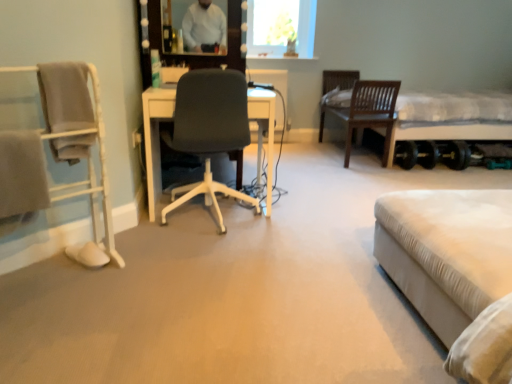
Where is `vacant area that lies between white fabric bed at lower right, which ranks as the 1th bed in bottom-to-top order, and black fabric chair at center, which appears as the 2th chair when viewed from the right`? Image resolution: width=512 pixels, height=384 pixels. vacant area that lies between white fabric bed at lower right, which ranks as the 1th bed in bottom-to-top order, and black fabric chair at center, which appears as the 2th chair when viewed from the right is located at coordinates (301, 273).